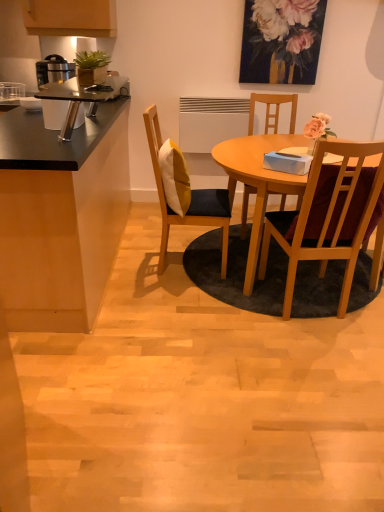
In order to click on free space in front of wooden chair at center right, the 3th chair from the left in this screenshot , I will do `click(311, 349)`.